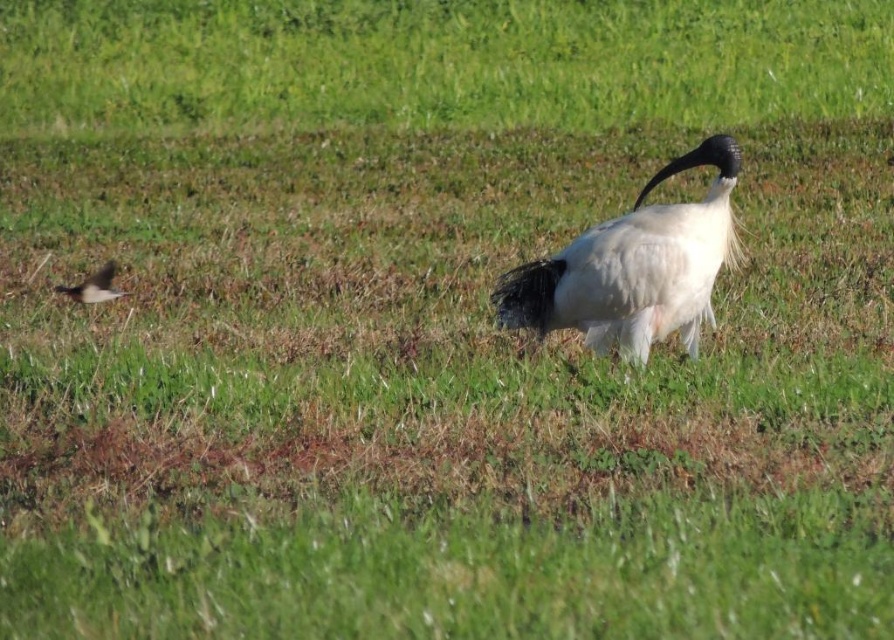
Consider the image. You are a wildlife photographer aiming to capture both birds in a single frame. Your camera has a focal length of 100mm and a sensor size that allows for a maximum distance coverage of 12 feet. Can you include both the white glossy bird at center and the brown feathered bird at left in your photo without moving the camera?

The white glossy bird at center is 13.02 feet away from the brown feathered bird at left. Since the maximum distance coverage is 12 feet, the 13.02 feet distance exceeds this limit, so you cannot include both birds in a single frame without moving the camera.

You are a nature photographer trying to capture both birds in your shot. The white glossy bird at center is your main subject. Given that the brown feathered bird at left is smaller, how should you adjust your camera focus to ensure both birds are in focus?

Since the white glossy bird at center is larger than the brown feathered bird at left, you should focus on the white glossy bird at center first, as its size indicates it is closer to the camera. This will help ensure both birds are within the depth of field and in focus.

You are a birdwatcher observing the scene. You notice two birds in the image. Which bird is positioned lower in the image, the white glossy bird at center or the brown feathered bird at left?

The white glossy bird at center is positioned lower in the image than the brown feathered bird at left.